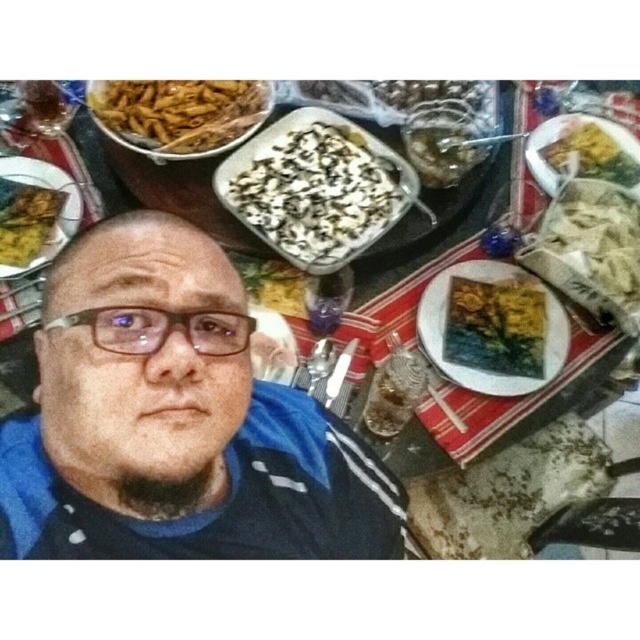
Question: Can you confirm if white matte noodles at right is wider than transparent plastic glasses at center?

Choices:
 (A) no
 (B) yes

Answer: (A)

Question: Estimate the real-world distances between objects in this image. Which object is closer to the transparent plastic glasses at center?

Choices:
 (A) blue fabric shirt at center
 (B) yellowish matte plate at upper right
 (C) yellow matte plate at upper left
 (D) slightly translucent glass bowl at center

Answer: (A)

Question: Which point is farther to the camera?

Choices:
 (A) (52, 451)
 (B) (556, 362)

Answer: (B)

Question: Is white matte noodles at right closer to camera compared to yellow matte plate at upper left?

Choices:
 (A) yes
 (B) no

Answer: (A)

Question: Can you confirm if white matte noodles at right is positioned above transparent plastic glasses at center?

Choices:
 (A) no
 (B) yes

Answer: (B)

Question: Which point is closer to the camera taking this photo?

Choices:
 (A) (58, 323)
 (B) (458, 161)
 (C) (228, 144)

Answer: (A)